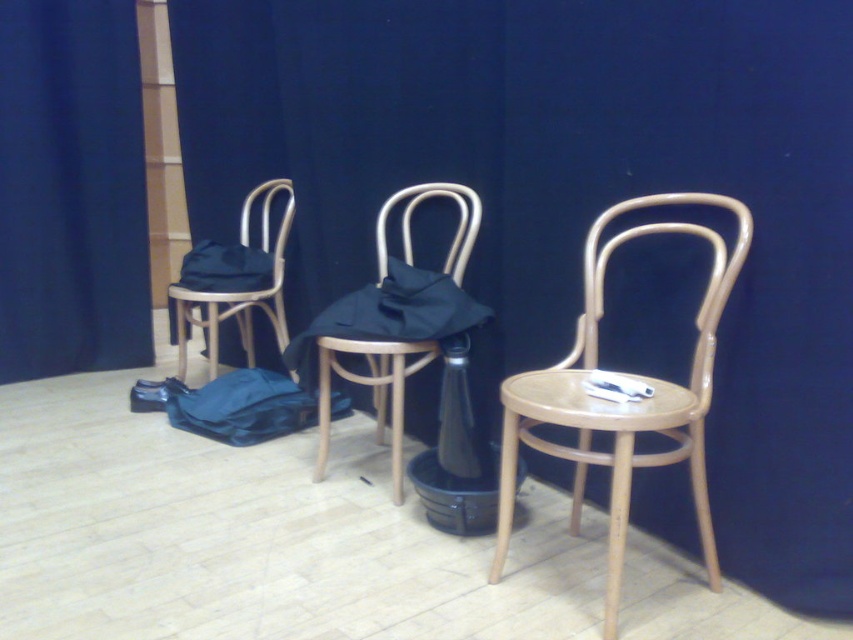
How far apart are blue fabric curtain at left and wooden chair at center?

blue fabric curtain at left is 5.04 feet from wooden chair at center.

Does blue fabric curtain at left appear under wooden chair at center?

Actually, blue fabric curtain at left is above wooden chair at center.

Who is more distant from viewer, [9,356] or [379,250]?

The point [9,356] is behind.

Locate an element on the screen. The image size is (853, 640). blue fabric curtain at left is located at coordinates (71, 189).

Does peach glossy chair at center appear on the left side of matte wood chair at left?

Incorrect, peach glossy chair at center is not on the left side of matte wood chair at left.

Who is more forward, (560,456) or (276,324)?

Point (560,456) is in front.

In order to click on peach glossy chair at center in this screenshot , I will do `click(625, 400)`.

Is blue fabric bag at center bigger than matte wood chair at left?

Actually, blue fabric bag at center might be smaller than matte wood chair at left.

Is point (138, 380) positioned behind point (248, 276)?

Yes, point (138, 380) is farther from viewer.

Who is more distant from viewer, (302, 413) or (262, 196)?

Point (262, 196)

The image size is (853, 640). Find the location of `blue fabric bag at center`. blue fabric bag at center is located at coordinates (230, 404).